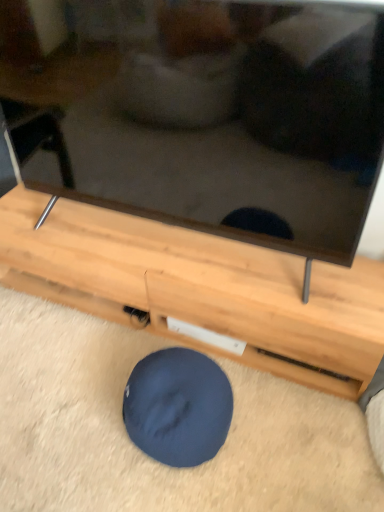
Question: Can you confirm if dark blue fabric dog bed at lower center is shorter than wooden tv stand at center?

Choices:
 (A) yes
 (B) no

Answer: (A)

Question: From the image's perspective, would you say dark blue fabric dog bed at lower center is shown under wooden tv stand at center?

Choices:
 (A) no
 (B) yes

Answer: (B)

Question: Is dark blue fabric dog bed at lower center positioned with its back to wooden tv stand at center?

Choices:
 (A) no
 (B) yes

Answer: (B)

Question: Considering the relative sizes of dark blue fabric dog bed at lower center and wooden tv stand at center in the image provided, is dark blue fabric dog bed at lower center bigger than wooden tv stand at center?

Choices:
 (A) no
 (B) yes

Answer: (A)

Question: From a real-world perspective, is dark blue fabric dog bed at lower center physically below wooden tv stand at center?

Choices:
 (A) yes
 (B) no

Answer: (A)

Question: Is wooden tv stand at center located within dark blue fabric dog bed at lower center?

Choices:
 (A) yes
 (B) no

Answer: (B)

Question: Is wooden tv stand at center shorter than dark blue fabric dog bed at lower center?

Choices:
 (A) yes
 (B) no

Answer: (B)

Question: Are wooden tv stand at center and dark blue fabric dog bed at lower center beside each other?

Choices:
 (A) yes
 (B) no

Answer: (B)

Question: Is wooden tv stand at center bigger than dark blue fabric dog bed at lower center?

Choices:
 (A) yes
 (B) no

Answer: (A)

Question: Is wooden tv stand at center turned away from dark blue fabric dog bed at lower center?

Choices:
 (A) yes
 (B) no

Answer: (A)

Question: Is wooden tv stand at center smaller than dark blue fabric dog bed at lower center?

Choices:
 (A) no
 (B) yes

Answer: (A)

Question: From a real-world perspective, is wooden tv stand at center below dark blue fabric dog bed at lower center?

Choices:
 (A) no
 (B) yes

Answer: (A)

Question: From a real-world perspective, is wooden tv stand at center above or below dark blue fabric dog bed at lower center?

Choices:
 (A) above
 (B) below

Answer: (A)